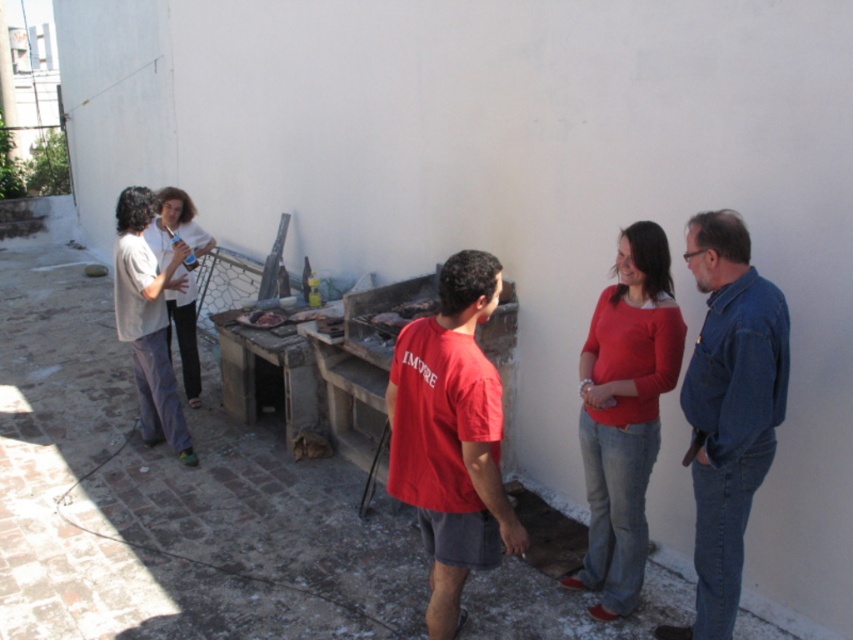
You are standing at the edge of the brick pavement and want to pick up the matte red sweater at center. Which direction should you move to reach it?

The matte red sweater at center is located at point 0.647 on the x and 0.733 on the y. Since you are at the edge of the brick pavement, you should move towards the center of the scene to reach it.

You are a photographer trying to capture a group photo of the blue denim shirt at right and the white matte shirt at left. Since you want to ensure both shirts are visible in the frame, which shirt should you adjust your camera angle to focus on first?

The blue denim shirt at right has a lesser width compared to the white matte shirt at left, so you should focus on the wider white matte shirt at left first to ensure it fits properly in the frame.